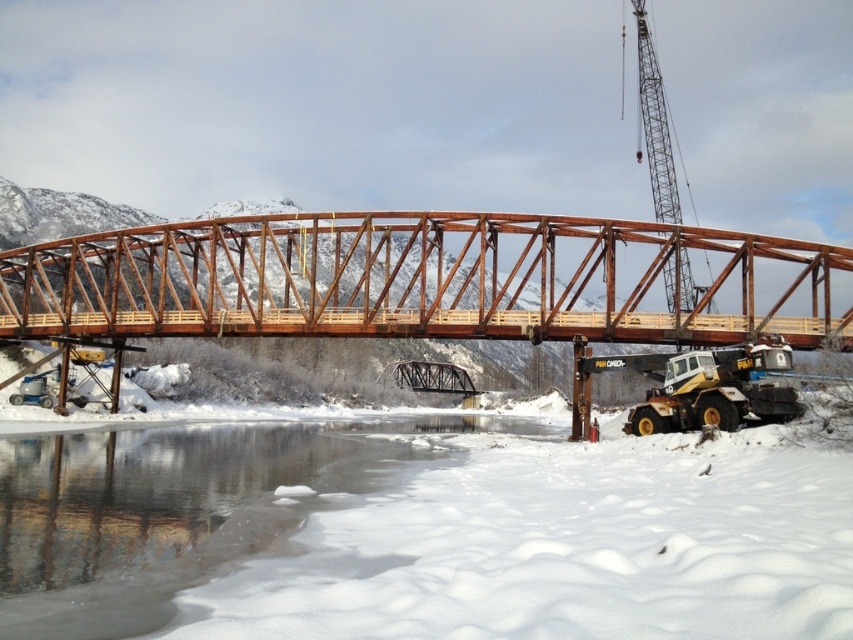
You are a construction worker standing at point [426,280]. What structure is directly beneath your feet?

The brown metallic bridge at center is located at point [426,280], so the structure directly beneath your feet is the brown metallic bridge at center.

You are a construction worker who needs to move a heavy beam from the yellow rubber excavator at lower right to the brown metallic bridge at center. Given that the excavator can lift objects up to 50 meters away, can it safely transport the beam to the bridge?

The brown metallic bridge at center and yellow rubber excavator at lower right are 51.20 meters apart. Since the excavator can only lift objects up to 50 meters away, it cannot safely transport the beam to the bridge as the distance exceeds its capacity.